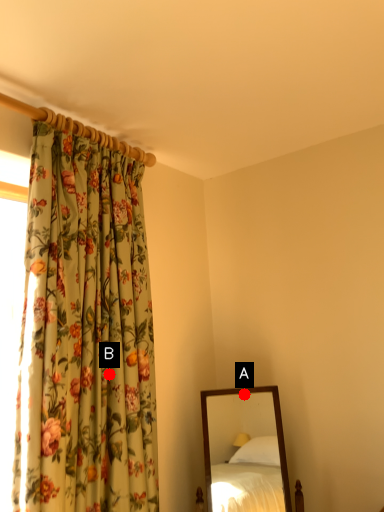
Question: Two points are circled on the image, labeled by A and B beside each circle. Which point appears farthest from the camera in this image?

Choices:
 (A) A is further
 (B) B is further

Answer: (A)